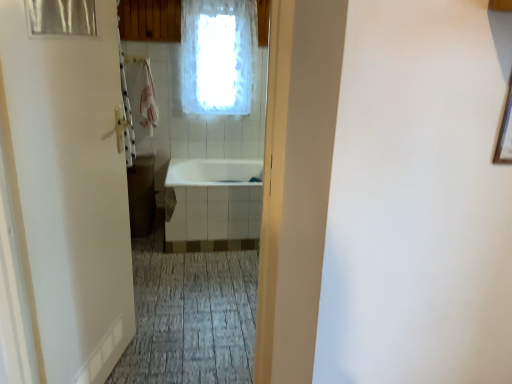
Question: From the image's perspective, is white frosted glass window at upper center below white glossy bathtub at center?

Choices:
 (A) no
 (B) yes

Answer: (A)

Question: Considering the relative sizes of white frosted glass window at upper center and white glossy bathtub at center in the image provided, is white frosted glass window at upper center wider than white glossy bathtub at center?

Choices:
 (A) no
 (B) yes

Answer: (A)

Question: Can you confirm if white frosted glass window at upper center is taller than white glossy bathtub at center?

Choices:
 (A) no
 (B) yes

Answer: (B)

Question: Considering the relative positions of white frosted glass window at upper center and white glossy bathtub at center in the image provided, is white frosted glass window at upper center to the left of white glossy bathtub at center from the viewer's perspective?

Choices:
 (A) yes
 (B) no

Answer: (B)

Question: Would you say white frosted glass window at upper center is outside white glossy bathtub at center?

Choices:
 (A) yes
 (B) no

Answer: (A)

Question: From a real-world perspective, is white frosted glass window at upper center over white glossy bathtub at center?

Choices:
 (A) no
 (B) yes

Answer: (B)

Question: Is transparent plastic shower curtain at upper left outside white matte door at left?

Choices:
 (A) yes
 (B) no

Answer: (B)

Question: Is transparent plastic shower curtain at upper left closer to camera compared to white matte door at left?

Choices:
 (A) yes
 (B) no

Answer: (B)

Question: From a real-world perspective, is transparent plastic shower curtain at upper left under white matte door at left?

Choices:
 (A) yes
 (B) no

Answer: (B)

Question: Is transparent plastic shower curtain at upper left thinner than white matte door at left?

Choices:
 (A) no
 (B) yes

Answer: (B)

Question: Is transparent plastic shower curtain at upper left to the right of white matte door at left from the viewer's perspective?

Choices:
 (A) yes
 (B) no

Answer: (B)

Question: Is transparent plastic shower curtain at upper left taller than white matte door at left?

Choices:
 (A) yes
 (B) no

Answer: (B)

Question: Is white glossy bathtub at center to the left of transparent plastic shower curtain at upper left from the viewer's perspective?

Choices:
 (A) no
 (B) yes

Answer: (A)